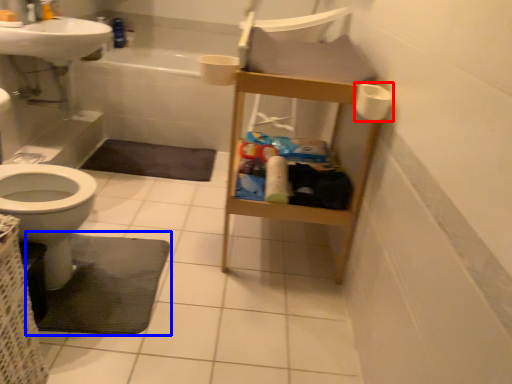
Question: Which object appears farthest to the camera in this image, toilet paper (highlighted by a red box) or bath mat (highlighted by a blue box)?

Choices:
 (A) toilet paper
 (B) bath mat

Answer: (B)